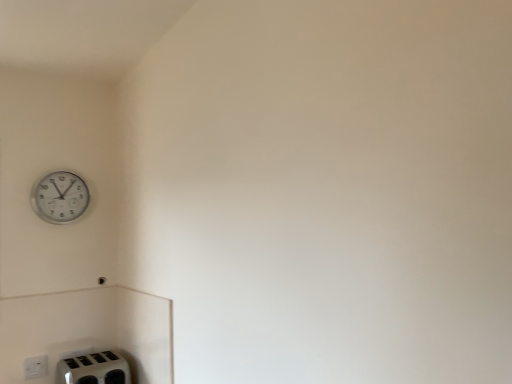
Question: Is white plastic electric outlet at lower left completely or partially outside of white plastic toaster at lower left?

Choices:
 (A) yes
 (B) no

Answer: (A)

Question: Is white plastic electric outlet at lower left oriented away from white plastic toaster at lower left?

Choices:
 (A) no
 (B) yes

Answer: (A)

Question: Can you confirm if white plastic electric outlet at lower left is taller than white plastic toaster at lower left?

Choices:
 (A) yes
 (B) no

Answer: (B)

Question: Is white plastic electric outlet at lower left bigger than white plastic toaster at lower left?

Choices:
 (A) no
 (B) yes

Answer: (A)

Question: Considering the relative sizes of white plastic electric outlet at lower left and white plastic toaster at lower left in the image provided, is white plastic electric outlet at lower left thinner than white plastic toaster at lower left?

Choices:
 (A) no
 (B) yes

Answer: (B)

Question: Is white plastic electric outlet at lower left positioned in front of white plastic toaster at lower left?

Choices:
 (A) yes
 (B) no

Answer: (B)

Question: From a real-world perspective, is white plastic wall clock at upper left located beneath white plastic toaster at lower left?

Choices:
 (A) no
 (B) yes

Answer: (A)

Question: Considering the relative sizes of white plastic wall clock at upper left and white plastic toaster at lower left in the image provided, is white plastic wall clock at upper left smaller than white plastic toaster at lower left?

Choices:
 (A) yes
 (B) no

Answer: (A)

Question: Is white plastic wall clock at upper left not within white plastic toaster at lower left?

Choices:
 (A) no
 (B) yes

Answer: (B)

Question: Would you say white plastic toaster at lower left is part of white plastic wall clock at upper left's contents?

Choices:
 (A) yes
 (B) no

Answer: (B)

Question: Is white plastic wall clock at upper left oriented towards white plastic toaster at lower left?

Choices:
 (A) yes
 (B) no

Answer: (B)

Question: Is white plastic wall clock at upper left thinner than white plastic toaster at lower left?

Choices:
 (A) yes
 (B) no

Answer: (A)

Question: Considering the relative sizes of white plastic wall clock at upper left and white plastic electric outlet at lower left in the image provided, is white plastic wall clock at upper left thinner than white plastic electric outlet at lower left?

Choices:
 (A) yes
 (B) no

Answer: (B)